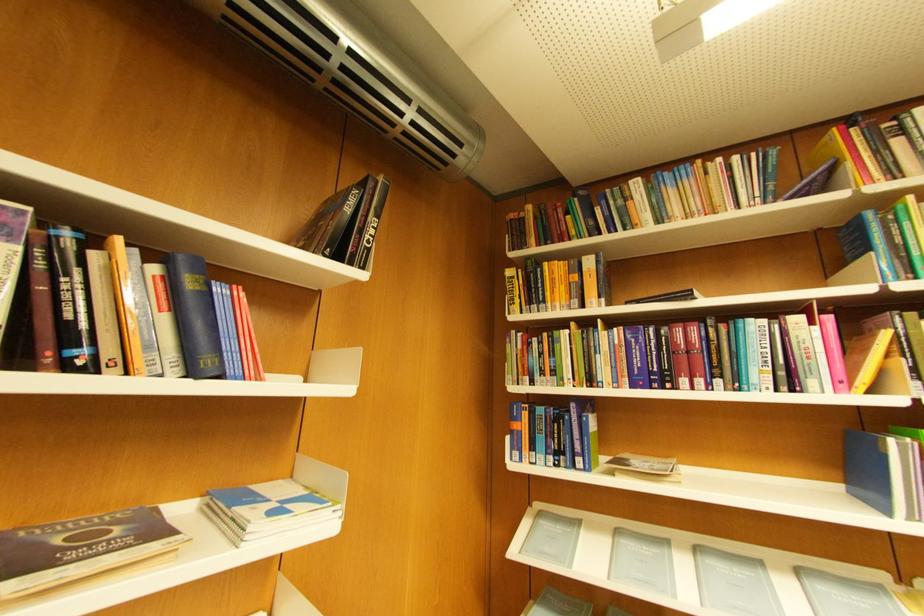
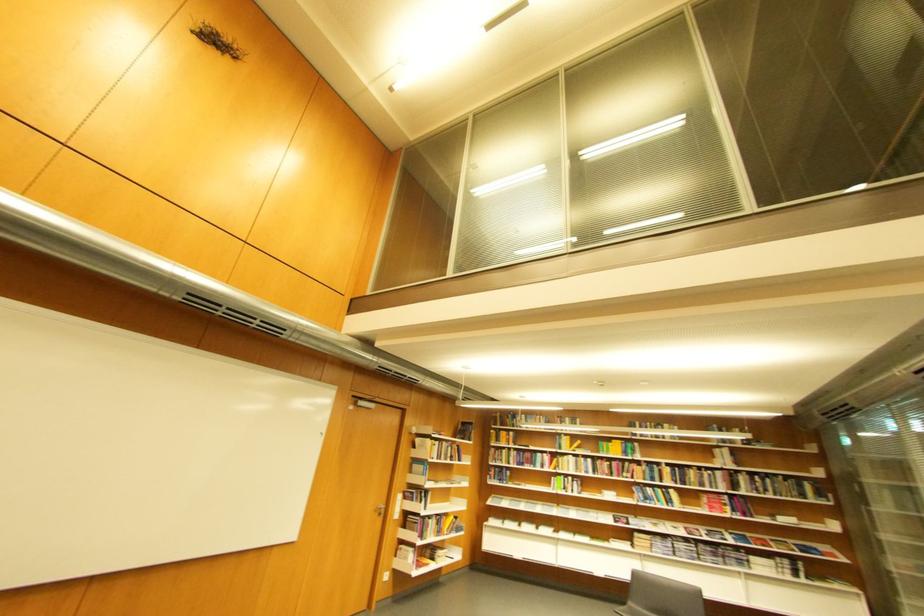
The point at (x=800, y=383) is marked in the first image. Where is the corresponding point in the second image?

(553, 468)